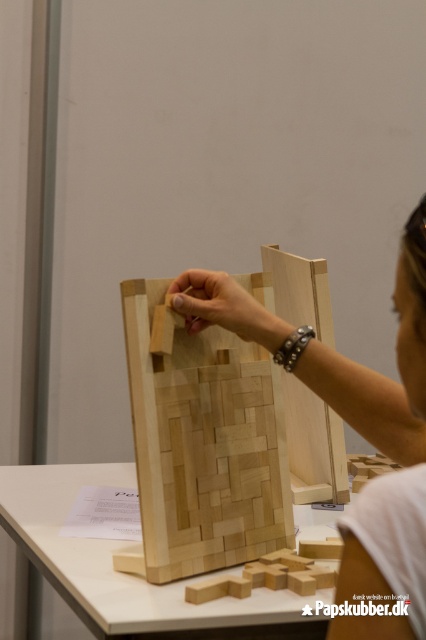
You are looking at the puzzle structure on the table. There are two points marked on the puzzle pieces labeled as point (176, 362) and point (394, 512). From your viewpoint, which point is closer to you?

Point (394, 512) is closer to you because point (176, 362) is behind it.

You are observing someone assembling a puzzle. You see the natural wood puzzle piece at center and the natural wood hand at center. Which object is closer to you?

The natural wood puzzle piece at center is closer to you than the natural wood hand at center.

You are trying to place the natural wood puzzle piece at center into the natural wood hand at center. Based on their sizes, will the puzzle piece fit comfortably in the hand?

The natural wood puzzle piece at center is bigger than the natural wood hand at center, so it will not fit comfortably in the hand.